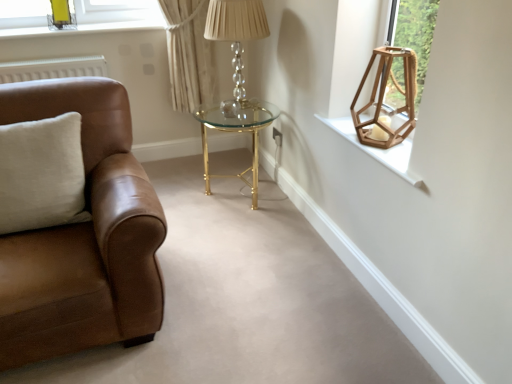
Question: Is the depth of white cotton pillow at left less than that of metallic gold lamp at upper left, which is the second lamp in front-to-back order?

Choices:
 (A) yes
 (B) no

Answer: (A)

Question: From the image's perspective, is white cotton pillow at left above metallic gold lamp at upper left, marked as the first lamp in a top-to-bottom arrangement?

Choices:
 (A) yes
 (B) no

Answer: (B)

Question: Can you confirm if white cotton pillow at left is wider than metallic gold lamp at upper left, which is counted as the first lamp, starting from the back?

Choices:
 (A) yes
 (B) no

Answer: (A)

Question: From the image's perspective, is white cotton pillow at left below metallic gold lamp at upper left, which is the second lamp in front-to-back order?

Choices:
 (A) yes
 (B) no

Answer: (A)

Question: Is white cotton pillow at left positioned beyond the bounds of metallic gold lamp at upper left, which ranks as the 1th lamp in left-to-right order?

Choices:
 (A) no
 (B) yes

Answer: (B)

Question: From a real-world perspective, is white cotton pillow at left over metallic gold lamp at upper left, which ranks as the 1th lamp in left-to-right order?

Choices:
 (A) no
 (B) yes

Answer: (A)

Question: Does wooden hexagonal lantern at upper right, marked as the second lamp in a back-to-front arrangement, have a greater height compared to white cotton pillow at left?

Choices:
 (A) no
 (B) yes

Answer: (A)

Question: From the image's perspective, would you say wooden hexagonal lantern at upper right, arranged as the 2th lamp when viewed from the left, is positioned over white cotton pillow at left?

Choices:
 (A) no
 (B) yes

Answer: (B)

Question: From the image's perspective, is wooden hexagonal lantern at upper right, arranged as the 2th lamp when viewed from the left, located beneath white cotton pillow at left?

Choices:
 (A) no
 (B) yes

Answer: (A)

Question: Is wooden hexagonal lantern at upper right, arranged as the 2th lamp when viewed from the left, beside white cotton pillow at left?

Choices:
 (A) no
 (B) yes

Answer: (A)

Question: Is wooden hexagonal lantern at upper right, placed as the 2th lamp when sorted from top to bottom, not near white cotton pillow at left?

Choices:
 (A) no
 (B) yes

Answer: (B)

Question: Does wooden hexagonal lantern at upper right, arranged as the 2th lamp when viewed from the left, contain white cotton pillow at left?

Choices:
 (A) yes
 (B) no

Answer: (B)

Question: From a real-world perspective, is crystal glass table lamp at center beneath wooden hexagonal lantern at upper right, the 1th lamp positioned from the right?

Choices:
 (A) no
 (B) yes

Answer: (B)